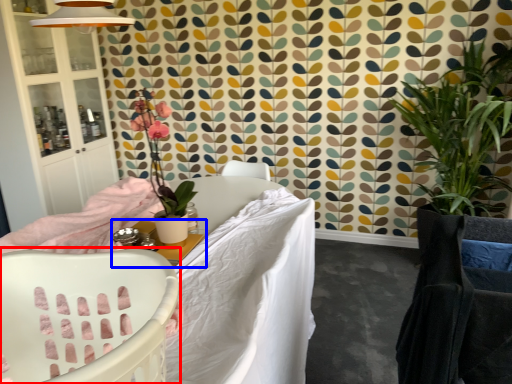
Question: Which point is closer to the camera, chair (highlighted by a red box) or table (highlighted by a blue box)?

Choices:
 (A) chair
 (B) table

Answer: (A)